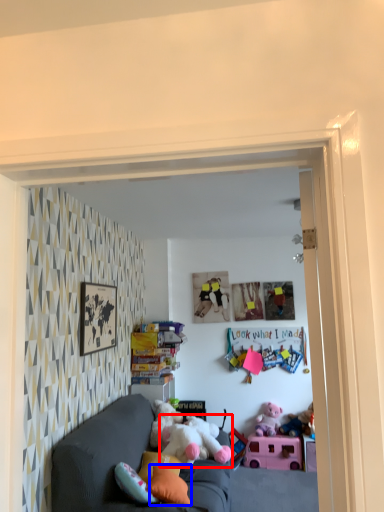
Question: Which object appears closest to the camera in this image, toy (highlighted by a red box) or pillow (highlighted by a blue box)?

Choices:
 (A) toy
 (B) pillow

Answer: (B)